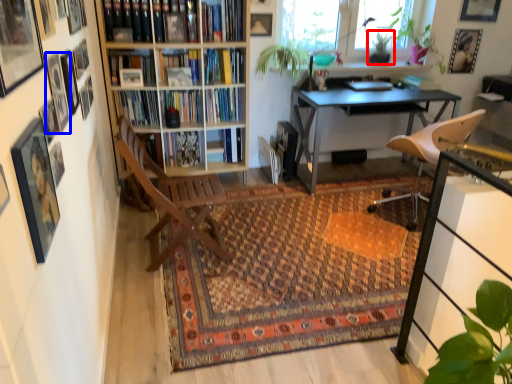
Question: Which object is further to the camera taking this photo, plant (highlighted by a red box) or picture frame (highlighted by a blue box)?

Choices:
 (A) plant
 (B) picture frame

Answer: (A)